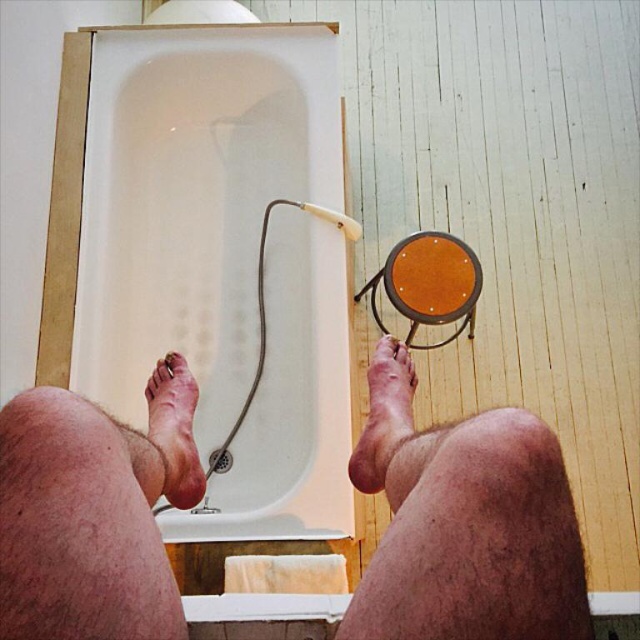
Question: Which of the following is the closest to the observer?

Choices:
 (A) (396, 410)
 (B) (429, 596)
 (C) (163, 422)

Answer: (B)

Question: Is white glossy bathtub at lower left below dry skin foot at lower left?

Choices:
 (A) yes
 (B) no

Answer: (B)

Question: Can you confirm if white glossy bathtub at lower left is positioned above dry skin foot at lower center?

Choices:
 (A) yes
 (B) no

Answer: (A)

Question: Can you confirm if hairy skin at lower center is positioned below dry skin foot at lower center?

Choices:
 (A) no
 (B) yes

Answer: (A)

Question: Which point is closer to the camera taking this photo?

Choices:
 (A) (355, 474)
 (B) (147, 440)

Answer: (B)

Question: Among these points, which one is nearest to the camera?

Choices:
 (A) (8, 538)
 (B) (282, 276)
 (C) (170, 452)
 (D) (380, 484)

Answer: (A)